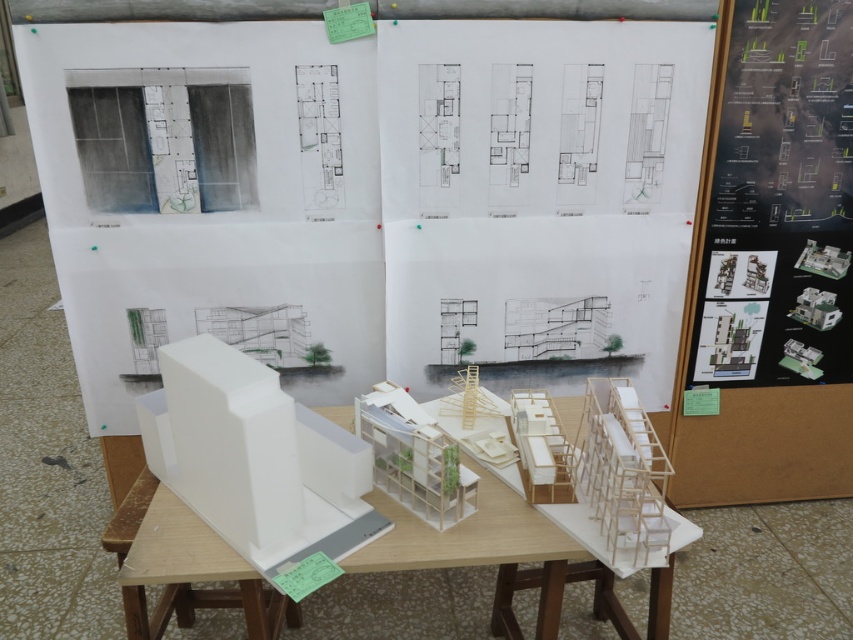
Question: Estimate the real-world distances between objects in this image. Which object is closer to the black matte poster at upper right?

Choices:
 (A) white matte model building at center
 (B) white matte building at left

Answer: (A)

Question: Is white matte building at left positioned behind white matte model building at center?

Choices:
 (A) no
 (B) yes

Answer: (A)

Question: Considering the relative positions of black matte poster at upper right and white matte model building at center in the image provided, where is black matte poster at upper right located with respect to white matte model building at center?

Choices:
 (A) right
 (B) left

Answer: (A)

Question: Estimate the real-world distances between objects in this image. Which object is closer to the white matte building at left?

Choices:
 (A) white matte model building at center
 (B) black matte poster at upper right

Answer: (A)

Question: Which object is closer to the camera taking this photo?

Choices:
 (A) white matte model building at center
 (B) black matte poster at upper right

Answer: (A)

Question: Does black matte poster at upper right have a lesser width compared to white matte building at left?

Choices:
 (A) no
 (B) yes

Answer: (B)